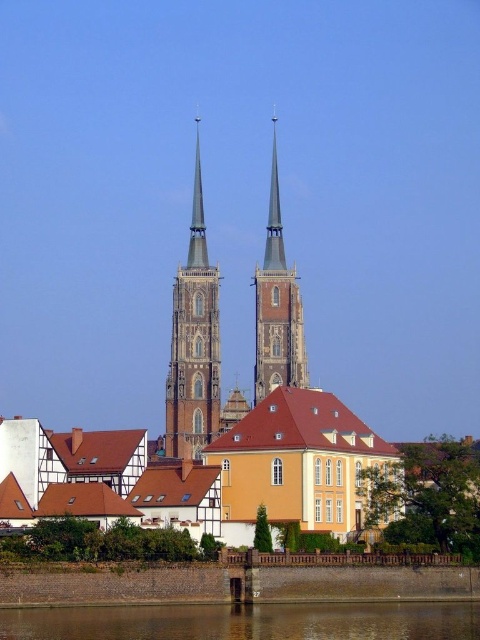
Between brown concrete wall at lower center and brown stone tower at center, which one is positioned higher?

brown stone tower at center is above.

Is point (10, 618) closer to camera compared to point (172, 312)?

Yes, it is.

You are a GUI agent. You are given a task and a screenshot of the screen. Output one action in this format:
    pyautogui.click(x=<x>, y=<y>)
    Task: Click on the brown concrete wall at lower center
    The height and width of the screenshot is (640, 480).
    Given the screenshot: What is the action you would take?
    pos(247,621)

Does brown concrete wall at lower center have a larger size compared to brown stone spire at center?

No, brown concrete wall at lower center is not bigger than brown stone spire at center.

Between brown concrete wall at lower center and brown stone spire at center, which one has less height?

Standing shorter between the two is brown concrete wall at lower center.

Where is `brown concrete wall at lower center`? The width and height of the screenshot is (480, 640). brown concrete wall at lower center is located at coordinates (247, 621).

Is brown stone tower at center above brown stone spire at center?

Correct, brown stone tower at center is located above brown stone spire at center.

Which is behind, point (200, 356) or point (263, 376)?

Positioned behind is point (200, 356).

Is point (171, 428) behind point (299, 378)?

No, (171, 428) is in front of (299, 378).

Locate an element on the screen. The width and height of the screenshot is (480, 640). brown stone tower at center is located at coordinates (193, 340).